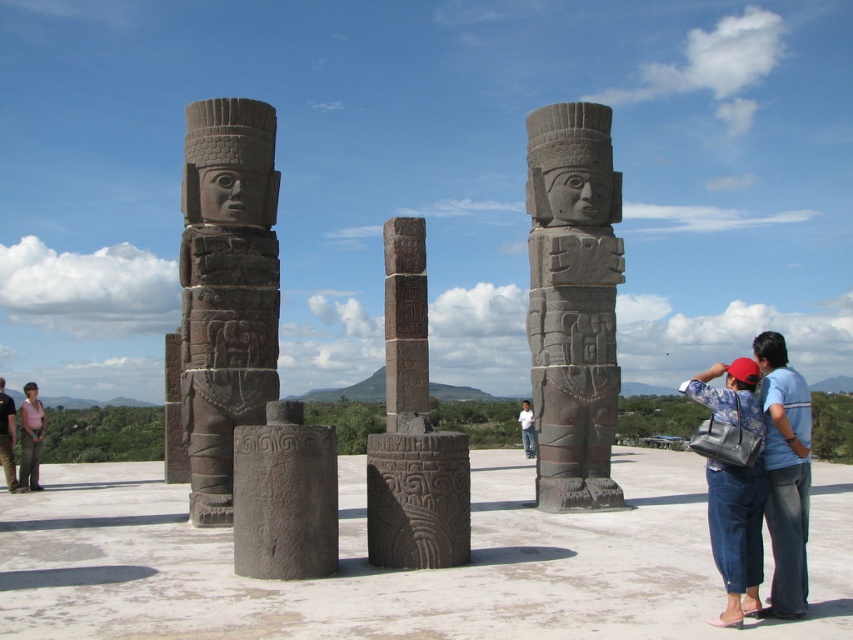
Does point (590, 500) lie behind point (525, 452)?

No, it is in front of (525, 452).

Does dark gray stone statue at center have a smaller size compared to white cotton shirt at center?

Correct, dark gray stone statue at center occupies less space than white cotton shirt at center.

Between point (566, 276) and point (525, 445), which one is positioned behind?

Point (525, 445)

Locate an element on the screen. Image resolution: width=853 pixels, height=640 pixels. dark gray stone statue at center is located at coordinates (573, 304).

Is point (276, 557) farther from viewer compared to point (36, 404)?

That is False.

Measure the distance between gray stone column at center and camera.

The distance of gray stone column at center from camera is 37.48 meters.

Is point (289, 464) closer to camera compared to point (38, 451)?

Yes, it is.

Where is `gray stone column at center`? This screenshot has height=640, width=853. gray stone column at center is located at coordinates (285, 497).

Consider the image. How distant is dark gray stone column at center from matte pink shirt at left?

They are 18.53 meters apart.

Looking at this image, does dark gray stone column at center have a larger size compared to matte pink shirt at left?

Incorrect, dark gray stone column at center is not larger than matte pink shirt at left.

At what (x,y) coordinates should I click in order to perform the action: click on dark gray stone column at center. Please return your answer as a coordinate pair (x, y). Looking at the image, I should click on pos(173,413).

You are a GUI agent. You are given a task and a screenshot of the screen. Output one action in this format:
    pyautogui.click(x=<x>, y=<y>)
    Task: Click on the dark gray stone column at center
    The height and width of the screenshot is (640, 853).
    Given the screenshot: What is the action you would take?
    pyautogui.click(x=173, y=413)